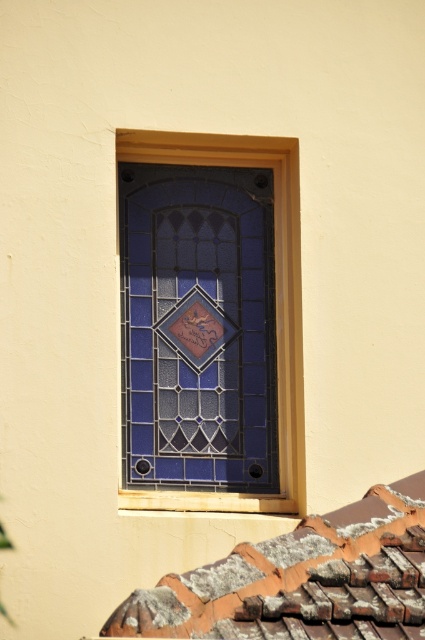
You are an architect examining the building exterior. You notice the rusty clay tiles at lower right and the blue stained glass at center. Which object is shorter in height?

The rusty clay tiles at lower right is not as tall as the blue stained glass at center, so the rusty clay tiles at lower right is shorter in height.

You are a window cleaner standing at the base of the building. You need to clean both the rusty clay tiles at lower right and the blue stained glass at center. Given that your ladder can reach up to 6 meters, can you safely clean both areas without moving the ladder?

The rusty clay tiles at lower right and blue stained glass at center are 6.42 meters apart. Since your ladder only reaches up to 6 meters, you cannot safely clean both areas without moving the ladder because the distance between them exceeds the ladder height limit.

You are standing in front of the building and want to touch the rusty clay tiles at lower right and the blue stained glass at center. Which object can you reach first without moving your position?

The rusty clay tiles at lower right can be reached first because they are closer to the viewer than the blue stained glass at center.